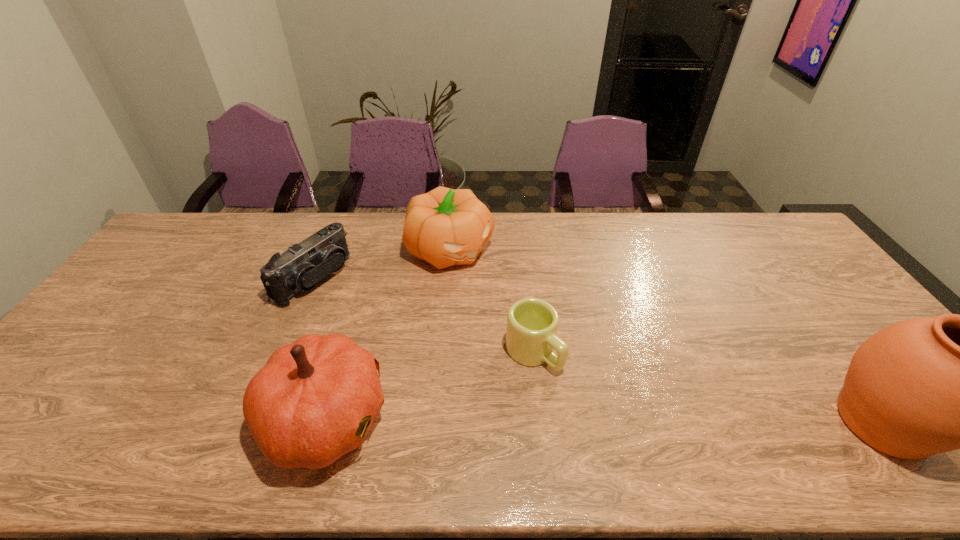
The image size is (960, 540). I want to click on the nearer pumpkin, so click(311, 403).

Locate an element on the screen. mug is located at coordinates (531, 337).

Locate an element on the screen. This screenshot has height=540, width=960. the farther pumpkin is located at coordinates (445, 227).

Where is `the third tallest object`? the third tallest object is located at coordinates (445, 227).

You are a GUI agent. You are given a task and a screenshot of the screen. Output one action in this format:
    pyautogui.click(x=<x>, y=<y>)
    Task: Click on the camcorder
    The height and width of the screenshot is (540, 960).
    Given the screenshot: What is the action you would take?
    pyautogui.click(x=300, y=268)

The height and width of the screenshot is (540, 960). What are the coordinates of `vacant area situated on the front-facing side of the nearer pumpkin` in the screenshot? It's located at (552, 418).

Locate an element on the screen. vacant position located 0.150m with the handle on the side of the mug is located at coordinates (599, 414).

Locate an element on the screen. The height and width of the screenshot is (540, 960). vacant space located 0.100m with the handle on the side of the mug is located at coordinates (584, 399).

Find the location of a particular element. The image size is (960, 540). vacant space positioned with the handle on the side of the mug is located at coordinates (574, 390).

At what (x,y) coordinates should I click in order to perform the action: click on free location located 0.200m on the carved face of the third tallest object. Please return your answer as a coordinate pair (x, y). Looking at the image, I should click on (522, 306).